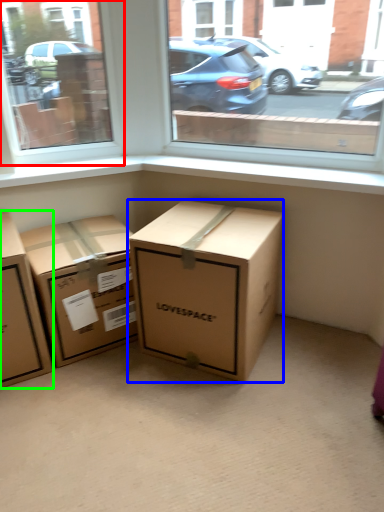
Question: Estimate the real-world distances between objects in this image. Which object is farther from window (highlighted by a red box), box (highlighted by a blue box) or box (highlighted by a green box)?

Choices:
 (A) box
 (B) box

Answer: (A)